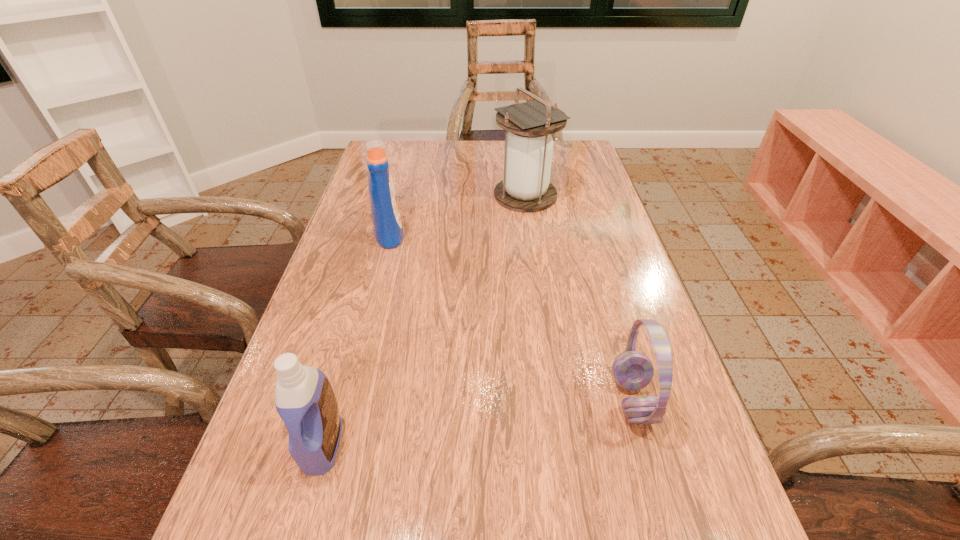
At what (x,y) coordinates should I click in order to perform the action: click on the farthest object. Please return your answer as a coordinate pair (x, y). Image resolution: width=960 pixels, height=540 pixels. Looking at the image, I should click on (528, 148).

The height and width of the screenshot is (540, 960). I want to click on the second object from right to left, so click(x=528, y=148).

You are a GUI agent. You are given a task and a screenshot of the screen. Output one action in this format:
    pyautogui.click(x=<x>, y=<y>)
    Task: Click on the second farthest object
    The height and width of the screenshot is (540, 960).
    Given the screenshot: What is the action you would take?
    (x=388, y=230)

Identify the location of the taller detergent. (388, 230).

Image resolution: width=960 pixels, height=540 pixels. In order to click on the third tallest object in this screenshot , I will do `click(304, 399)`.

The height and width of the screenshot is (540, 960). In order to click on the nearer detergent in this screenshot , I will do `click(304, 399)`.

Identify the location of the rightmost object. The image size is (960, 540). (632, 370).

The width and height of the screenshot is (960, 540). I want to click on headset, so click(x=632, y=370).

Find the location of a particular element. free space located on the front of the lantern is located at coordinates (536, 266).

You are a GUI agent. You are given a task and a screenshot of the screen. Output one action in this format:
    pyautogui.click(x=<x>, y=<y>)
    Task: Click on the free space located 0.240m on the label of the second farthest object
    The image size is (960, 540).
    Given the screenshot: What is the action you would take?
    pyautogui.click(x=494, y=233)